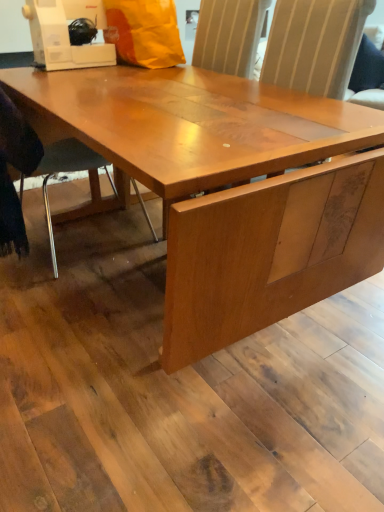
The width and height of the screenshot is (384, 512). Describe the element at coordinates (57, 170) in the screenshot. I see `metallic gray chair at lower left` at that location.

The image size is (384, 512). I want to click on orange matte paper bag at upper center, so click(144, 32).

Where is `metallic gray chair at lower left`? Image resolution: width=384 pixels, height=512 pixels. metallic gray chair at lower left is located at coordinates (57, 170).

Is metallic gray chair at lower left taller or shorter than orange matte paper bag at upper center?

In the image, metallic gray chair at lower left appears to be taller than orange matte paper bag at upper center.

Which is closer, (146, 217) or (159, 38)?

Point (146, 217) is positioned farther from the camera compared to point (159, 38).

Looking at their sizes, would you say metallic gray chair at lower left is wider or thinner than orange matte paper bag at upper center?

metallic gray chair at lower left is wider than orange matte paper bag at upper center.

From the image's perspective, is metallic gray chair at lower left above or below orange matte paper bag at upper center?

metallic gray chair at lower left is below orange matte paper bag at upper center.

Is white plastic sewing machine at upper left wider than metallic gray chair at lower left?

In fact, white plastic sewing machine at upper left might be narrower than metallic gray chair at lower left.

Considering the relative positions of white plastic sewing machine at upper left and metallic gray chair at lower left in the image provided, is white plastic sewing machine at upper left to the left of metallic gray chair at lower left from the viewer's perspective?

Incorrect, white plastic sewing machine at upper left is not on the left side of metallic gray chair at lower left.

Is white plastic sewing machine at upper left looking in the opposite direction of metallic gray chair at lower left?

white plastic sewing machine at upper left does not have its back to metallic gray chair at lower left.

From a real-world perspective, is white plastic sewing machine at upper left positioned under metallic gray chair at lower left based on gravity?

No, from a real-world perspective, white plastic sewing machine at upper left is not below metallic gray chair at lower left.

Is metallic gray chair at lower left outside of white plastic sewing machine at upper left?

metallic gray chair at lower left is positioned outside white plastic sewing machine at upper left.

Is metallic gray chair at lower left to the left or to the right of white plastic sewing machine at upper left in the image?

Clearly, metallic gray chair at lower left is on the left of white plastic sewing machine at upper left in the image.

From the picture: Is metallic gray chair at lower left turned away from white plastic sewing machine at upper left?

No, metallic gray chair at lower left is not facing the opposite direction of white plastic sewing machine at upper left.

Is orange matte paper bag at upper center aimed at metallic gray chair at lower left?

No, orange matte paper bag at upper center is not facing towards metallic gray chair at lower left.

In the image, there is a orange matte paper bag at upper center. Where is `chair below it (from a real-world perspective)`? The width and height of the screenshot is (384, 512). chair below it (from a real-world perspective) is located at coordinates (57, 170).

Would you say orange matte paper bag at upper center is a long distance from metallic gray chair at lower left?

Actually, orange matte paper bag at upper center and metallic gray chair at lower left are a little close together.

Measure the distance from white plastic sewing machine at upper left to orange matte paper bag at upper center.

A distance of 7.38 inches exists between white plastic sewing machine at upper left and orange matte paper bag at upper center.

Between point (59, 35) and point (149, 13), which one is positioned behind?

The point (149, 13) is farther.

Consider the image. Between white plastic sewing machine at upper left and orange matte paper bag at upper center, which one has smaller width?

With smaller width is white plastic sewing machine at upper left.

How different are the orientations of white plastic sewing machine at upper left and orange matte paper bag at upper center in degrees?

10.4 degrees separate the facing orientations of white plastic sewing machine at upper left and orange matte paper bag at upper center.

How much distance is there between orange matte paper bag at upper center and white plastic sewing machine at upper left?

A distance of 7.38 inches exists between orange matte paper bag at upper center and white plastic sewing machine at upper left.

How many degrees apart are the facing directions of orange matte paper bag at upper center and white plastic sewing machine at upper left?

There is a 10.4-degree angle between the facing directions of orange matte paper bag at upper center and white plastic sewing machine at upper left.

You are a GUI agent. You are given a task and a screenshot of the screen. Output one action in this format:
    pyautogui.click(x=<x>, y=<y>)
    Task: Click on the sewing machine on the left of orange matte paper bag at upper center
    
    Given the screenshot: What is the action you would take?
    pyautogui.click(x=66, y=34)

Does orange matte paper bag at upper center appear on the left side of white plastic sewing machine at upper left?

No, orange matte paper bag at upper center is not to the left of white plastic sewing machine at upper left.

What are the coordinates of `paper bag lying above the metallic gray chair at lower left (from the image's perspective)` in the screenshot? It's located at (144, 32).

Locate an element on the screen. Image resolution: width=384 pixels, height=512 pixels. sewing machine on the right of the metallic gray chair at lower left is located at coordinates point(66,34).

Based on their spatial positions, is white plastic sewing machine at upper left or orange matte paper bag at upper center closer to metallic gray chair at lower left?

white plastic sewing machine at upper left.

Considering their positions, is metallic gray chair at lower left positioned further to white plastic sewing machine at upper left than orange matte paper bag at upper center?

metallic gray chair at lower left.

Considering their positions, is orange matte paper bag at upper center positioned further to metallic gray chair at lower left than white plastic sewing machine at upper left?

Based on the image, orange matte paper bag at upper center appears to be further to metallic gray chair at lower left.

Looking at this image, from the image, which object appears to be nearer to white plastic sewing machine at upper left, orange matte paper bag at upper center or metallic gray chair at lower left?

Among the two, orange matte paper bag at upper center is located nearer to white plastic sewing machine at upper left.

Which object lies further to the anchor point orange matte paper bag at upper center, metallic gray chair at lower left or white plastic sewing machine at upper left?

Among the two, metallic gray chair at lower left is located further to orange matte paper bag at upper center.

Considering their positions, is white plastic sewing machine at upper left positioned further to orange matte paper bag at upper center than metallic gray chair at lower left?

metallic gray chair at lower left.

Identify the location of sewing machine between orange matte paper bag at upper center and metallic gray chair at lower left in the up-down direction. (66, 34).